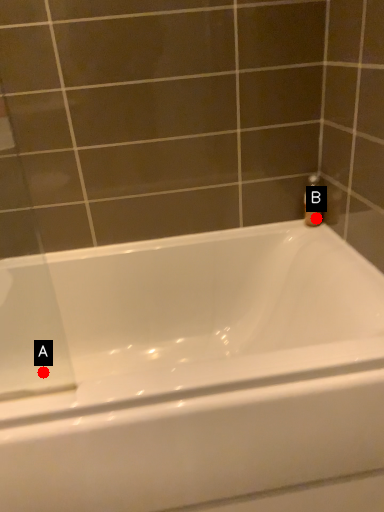
Question: Two points are circled on the image, labeled by A and B beside each circle. Which point is further to the camera?

Choices:
 (A) A is further
 (B) B is further

Answer: (A)